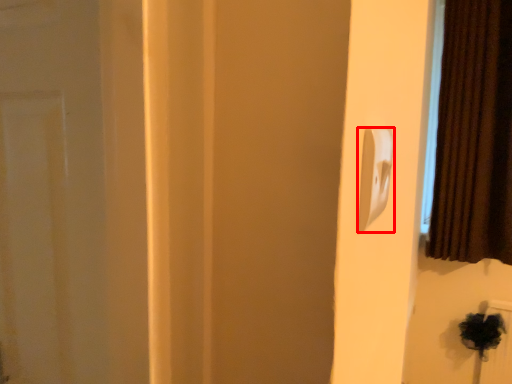
Question: From the image's perspective, considering the relative positions of light switch (annotated by the red box) and curtain in the image provided, where is light switch (annotated by the red box) located with respect to the staircase?

Choices:
 (A) above
 (B) below

Answer: (B)